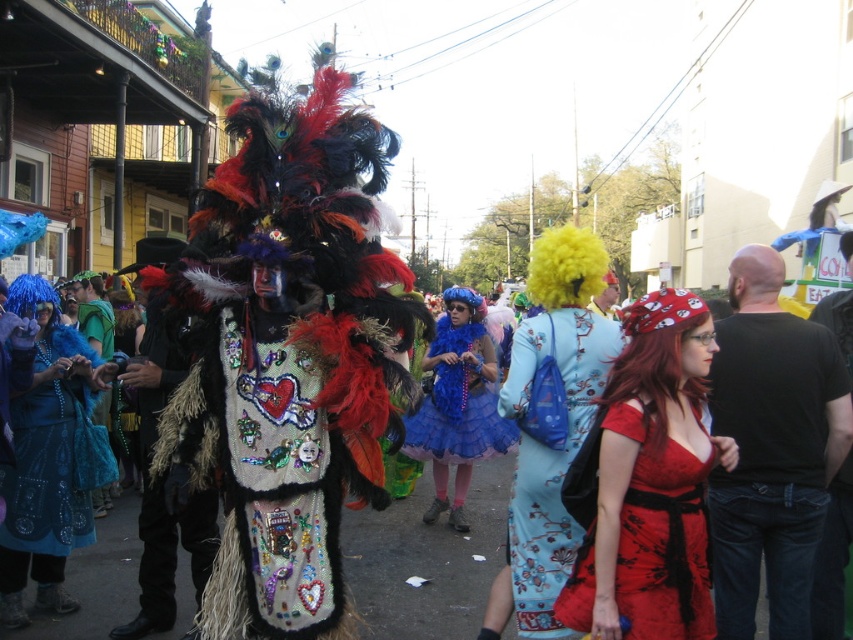
You are a photographer trying to capture both the black cotton shirt at right and the shiny blue fabric dress at left in a single shot. Which one will appear closer to the camera in your photo?

The black cotton shirt at right will appear closer to the camera because it is in front of the shiny blue fabric dress at left.

You are a photographer trying to capture the vibrant street scene. You notice the floral silk dress at center and the shiny blue tulle skirt at center. Which clothing item is wider when viewed from your position?

The floral silk dress at center is wider than the shiny blue tulle skirt at center.

You are a photographer trying to capture both the matte red dress at center and the shiny blue fabric dress at left in a single frame. Given that your camera has a focal length of 50mm and the minimum distance between the dresses for a clear shot is 2 meters, can you position yourself to include both in your photo?

The matte red dress at center and the shiny blue fabric dress at left are 3.14 meters apart, which exceeds the minimum required distance of 2 meters. Therefore, you can position yourself to include both in your photo as the distance between them is sufficient for a clear shot with a 50mm focal length.